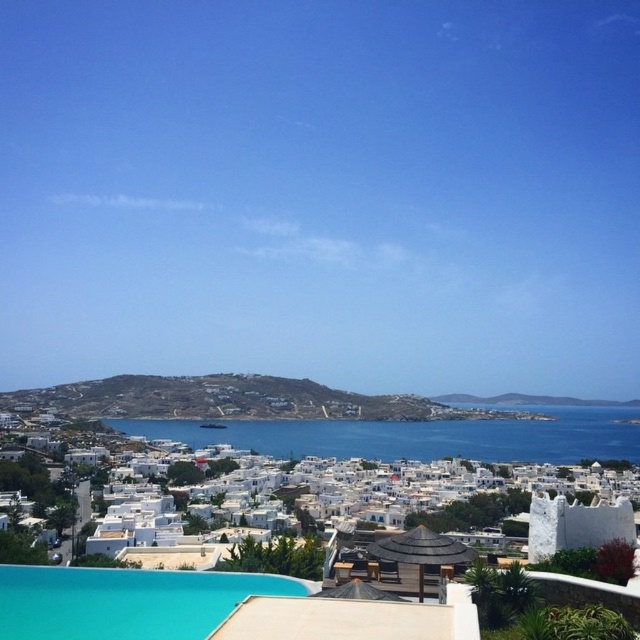
You are standing at the edge of the blue water at center in the coastal town. If you look directly ahead, which direction would you face? Please choose from the following options based on the scene description provided. A. Towards the infinity pool. B. Towards the thatched roof umbrella and lounge chairs. C. Towards the cluster of white buildings. D. Towards the horizon line.

The blue water at center is positioned at point (419,436). Since the infinity pool seamlessly blends into the horizon, facing directly ahead from the blue water at center would align with the horizon line. The correct answer is D. Towards the horizon line.

You are standing at the edge of the infinity pool in the coastal town. A friend is holding a beach ball and wants to throw it into the blue water at center marked by point (419, 436). To ensure the ball lands in the water, in which direction should your friend aim relative to the thatched roof umbrella?

The blue water at center marked by point (419, 436) is located directly in front of the thatched roof umbrella. Your friend should aim straight ahead towards the center to ensure the beach ball lands in the water.

You are a drone operator who needs to capture a photo of both the blue water at center and the turquoise glossy pool at lower center in the coastal town scene. Given that your drone can only fly within a 1500 feet radius, will you be able to capture both locations in a single shot without moving the drone?

The blue water at center and turquoise glossy pool at lower center are 1533.50 feet apart from each other, which exceeds the drone operator s 1500 feet radius limit. Therefore, it will not be possible to capture both locations in a single shot without moving the drone.